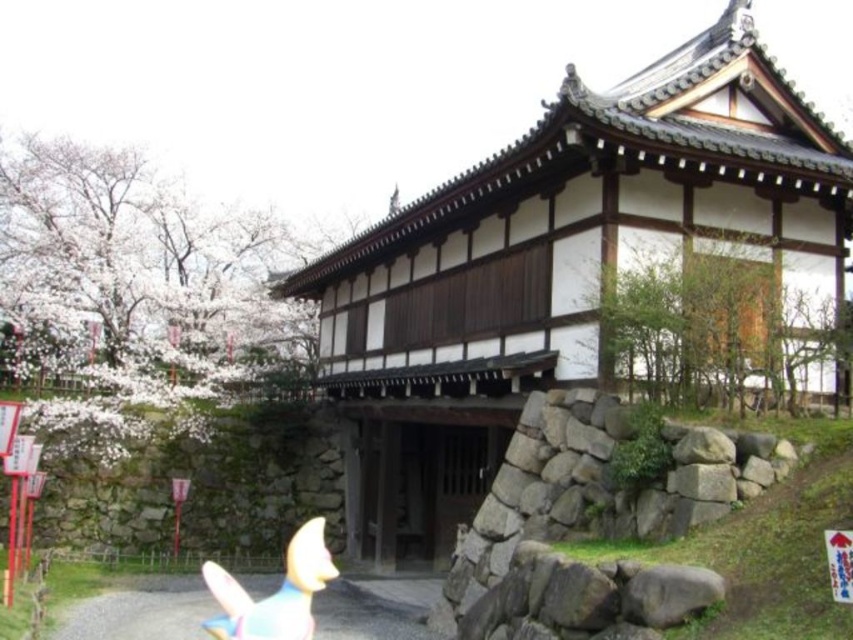
Between point (444, 454) and point (245, 621), which one is positioned in front?

Point (245, 621) is more forward.

Can you confirm if white wooden temple at center is positioned above matte yellow plush toy at lower left?

Correct, white wooden temple at center is located above matte yellow plush toy at lower left.

Is point (541, 186) closer to viewer compared to point (300, 627)?

No, it is behind (300, 627).

This screenshot has width=853, height=640. In order to click on white wooden temple at center in this screenshot , I will do `click(555, 266)`.